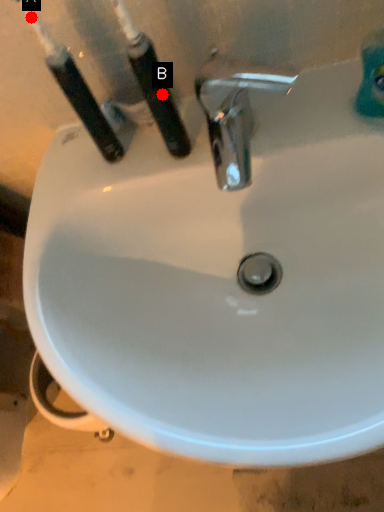
Question: Two points are circled on the image, labeled by A and B beside each circle. Which point appears farthest from the camera in this image?

Choices:
 (A) A is further
 (B) B is further

Answer: (B)